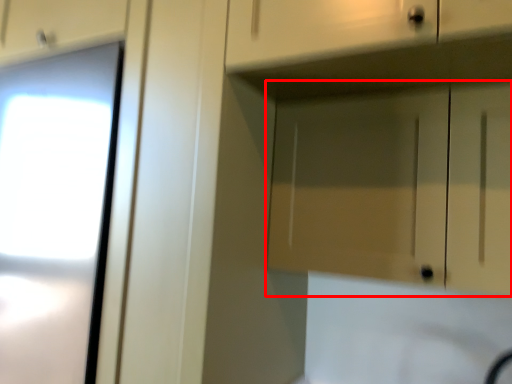
Question: From the image's perspective, considering the relative positions of cabinetry (annotated by the red box) and drawer in the image provided, where is cabinetry (annotated by the red box) located with respect to the staircase?

Choices:
 (A) below
 (B) above

Answer: (A)